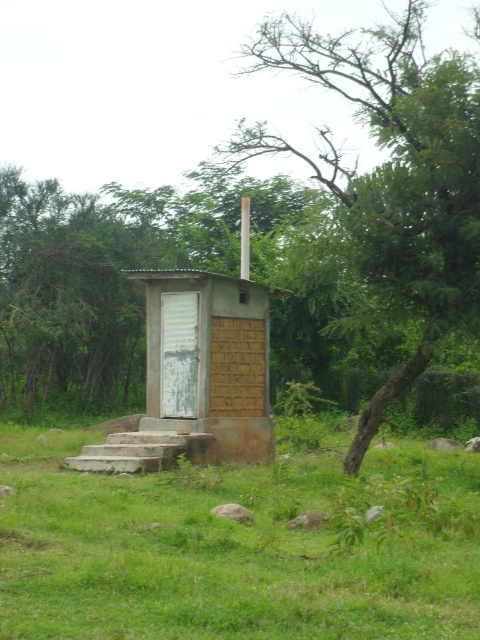
You are standing in a grassy area and see the brown concrete outhouse at center and the green leafy tree at center. Which object is nearer to you?

The brown concrete outhouse at center is closer to the viewer than the green leafy tree at center, so the brown concrete outhouse at center is nearer to you.

You are a construction worker planning to place a 3.5 meter long wooden beam between the brown concrete outhouse at center and the brown corrugated metal hut at center. Will the beam fit between them?

The brown concrete outhouse at center and brown corrugated metal hut at center are 2.89 meters apart. The beam is 3.5 meters long, which is longer than the distance between them, so the beam will not fit between them.